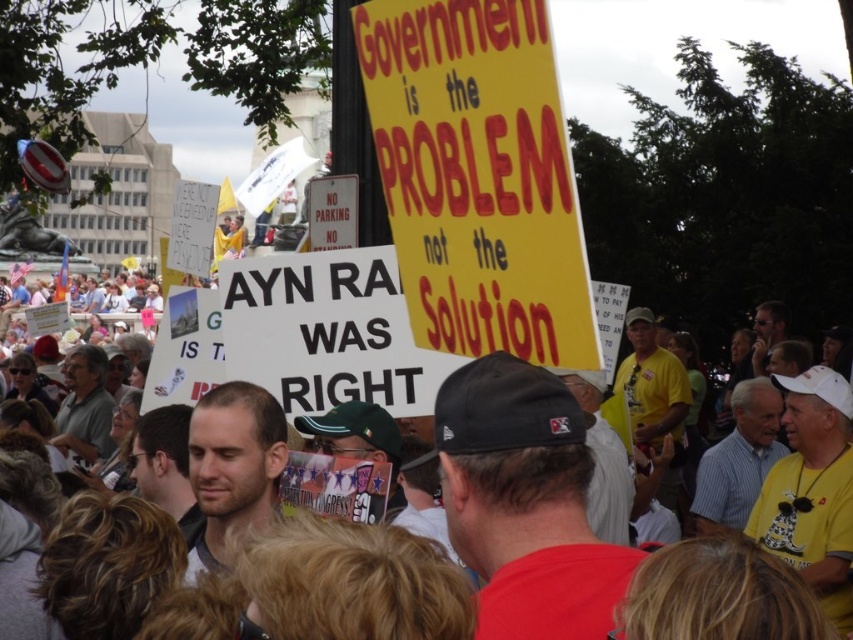
From the picture: You are a photographer at the protest scene. You want to take a photo that includes both the light brown hair at center and the gray shirt at left. Based on their positions, which one should be placed on the left side of the photo to ensure both are visible?

The gray shirt at left should be placed on the left side of the photo since the light brown hair at center is to the right of it, ensuring both are visible in the frame.